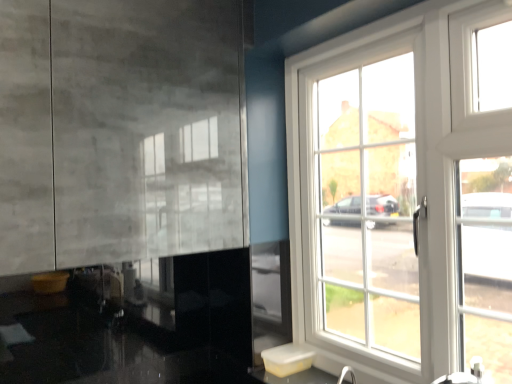
The image size is (512, 384). Describe the element at coordinates (404, 194) in the screenshot. I see `white glass window at right` at that location.

Measure the distance between white glass window at right and camera.

38.78 inches.

What is the approximate height of white glass window at right?

1.12 meters.

This screenshot has height=384, width=512. I want to click on white glass window at right, so click(404, 194).

At what (x,y) coordinates should I click in order to perform the action: click on white glossy sink at lower right. Please return your answer as a coordinate pair (x, y). Image resolution: width=512 pixels, height=384 pixels. Looking at the image, I should click on (298, 366).

The width and height of the screenshot is (512, 384). Describe the element at coordinates (298, 366) in the screenshot. I see `white glossy sink at lower right` at that location.

Measure the distance between white glossy sink at lower right and camera.

The depth of white glossy sink at lower right is 1.38 meters.

This screenshot has height=384, width=512. What are the coordinates of `white glass window at right` in the screenshot? It's located at (x=404, y=194).

Consider the image. Between white glossy sink at lower right and white glass window at right, which one appears on the right side from the viewer's perspective?

white glass window at right.

Consider the image. Is white glossy sink at lower right in front of or behind white glass window at right in the image?

white glossy sink at lower right is in front of white glass window at right.

Which is in front, point (275, 375) or point (436, 18)?

Point (436, 18)

From the image's perspective, is white glossy sink at lower right on white glass window at right?

No.

From a real-world perspective, which is physically below, white glossy sink at lower right or white glass window at right?

In real-world perspective, white glossy sink at lower right is lower.

Which of these two, white glossy sink at lower right or white glass window at right, is thinner?

white glass window at right.

In terms of height, does white glossy sink at lower right look taller or shorter compared to white glass window at right?

Considering their sizes, white glossy sink at lower right has less height than white glass window at right.

Who is smaller, white glossy sink at lower right or white glass window at right?

white glossy sink at lower right.

Do you think white glossy sink at lower right is within white glass window at right, or outside of it?

white glossy sink at lower right is spatially situated outside white glass window at right.

Would you consider white glossy sink at lower right to be distant from white glass window at right?

Actually, white glossy sink at lower right and white glass window at right are a little close together.

Could you tell me if white glossy sink at lower right is facing white glass window at right?

No.

How many degrees apart are the facing directions of white glossy sink at lower right and white glass window at right?

The facing directions of white glossy sink at lower right and white glass window at right are 0.696 degrees apart.

This screenshot has width=512, height=384. Identify the location of window on the right of white glossy sink at lower right. [404, 194].

Which is more to the right, white glass window at right or white glossy sink at lower right?

Positioned to the right is white glass window at right.

Between white glass window at right and white glossy sink at lower right, which one is positioned in front?

white glossy sink at lower right is in front.

Is point (377, 289) more distant than point (307, 363)?

No, (377, 289) is in front of (307, 363).

From the image's perspective, who appears lower, white glass window at right or white glossy sink at lower right?

white glossy sink at lower right is shown below in the image.

From a real-world perspective, who is located higher, white glass window at right or white glossy sink at lower right?

white glass window at right is physically above.

Considering the sizes of objects white glass window at right and white glossy sink at lower right in the image provided, who is thinner, white glass window at right or white glossy sink at lower right?

Thinner between the two is white glass window at right.

Between white glass window at right and white glossy sink at lower right, which one has less height?

Standing shorter between the two is white glossy sink at lower right.

Is white glass window at right bigger or smaller than white glossy sink at lower right?

Considering their sizes, white glass window at right takes up more space than white glossy sink at lower right.

Is white glass window at right located outside white glossy sink at lower right?

Yes, white glass window at right is not within white glossy sink at lower right.

Is white glass window at right far from white glossy sink at lower right?

No, white glass window at right is not far away from white glossy sink at lower right.

Is white glass window at right facing away from white glossy sink at lower right?

No, white glass window at right is not facing away from white glossy sink at lower right.

Where is `window behind the white glossy sink at lower right`? This screenshot has width=512, height=384. window behind the white glossy sink at lower right is located at coordinates (404, 194).

Identify the location of window above the white glossy sink at lower right (from the image's perspective). The height and width of the screenshot is (384, 512). (404, 194).

I want to click on sink that appears in front of the white glass window at right, so click(x=298, y=366).